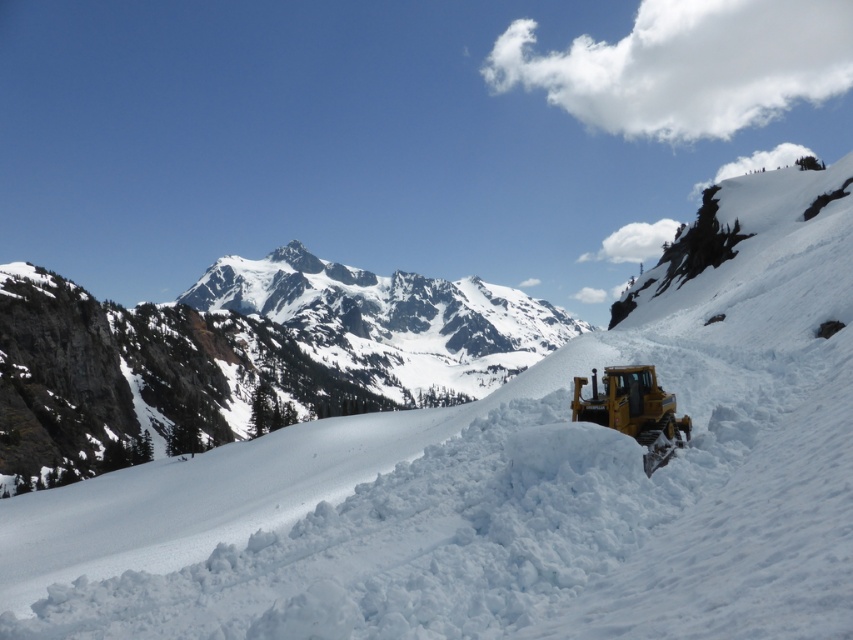
Does point (253, 353) lie in front of point (616, 388)?

No, (253, 353) is further to viewer.

Between snowy rocky mountain at center and yellow metallic plow at center-right, which one is positioned lower?

yellow metallic plow at center-right is lower down.

At what (x,y) coordinates should I click in order to perform the action: click on snowy rocky mountain at center. Please return your answer as a coordinate pair (x, y). Image resolution: width=853 pixels, height=640 pixels. Looking at the image, I should click on (242, 356).

Image resolution: width=853 pixels, height=640 pixels. Find the location of `snowy rocky mountain at center`. snowy rocky mountain at center is located at coordinates (242, 356).